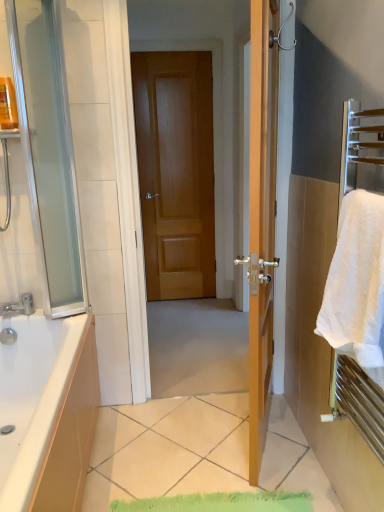
Question: From the image's perspective, relative to white fluffy towel at right, is transparent glass screen door at left above or below?

Choices:
 (A) above
 (B) below

Answer: (A)

Question: In terms of size, does transparent glass screen door at left appear bigger or smaller than white fluffy towel at right?

Choices:
 (A) big
 (B) small

Answer: (A)

Question: Estimate the real-world distances between objects in this image. Which object is farther from the transparent glass screen door at left?

Choices:
 (A) white glossy tile at center
 (B) translucent plastic bottle at upper left
 (C) white fluffy towel at right
 (D) wooden door at center
 (E) brushed metal faucet at lower left

Answer: (D)

Question: Based on their relative distances, which object is farther from the wooden door at center?

Choices:
 (A) brushed metal faucet at lower left
 (B) transparent glass screen door at left
 (C) white fluffy towel at right
 (D) translucent plastic bottle at upper left
 (E) white glossy tile at center

Answer: (C)